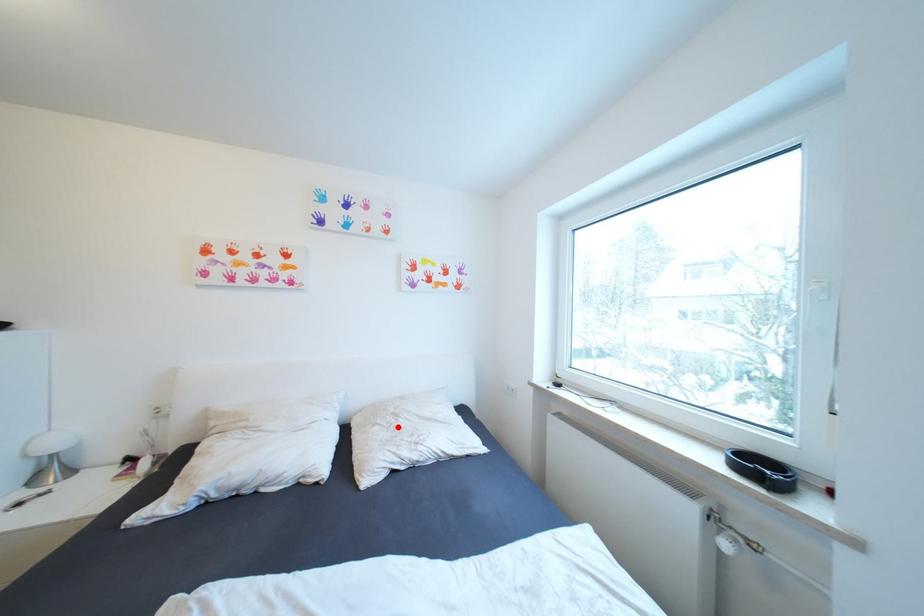
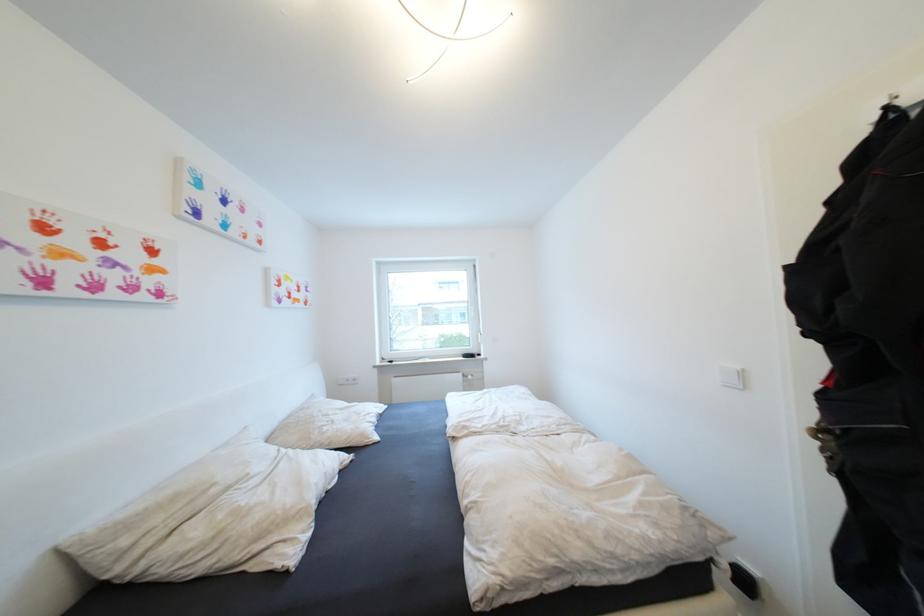
Locate, in the second image, the point that corresponds to the highlighted location in the first image.

(339, 423)